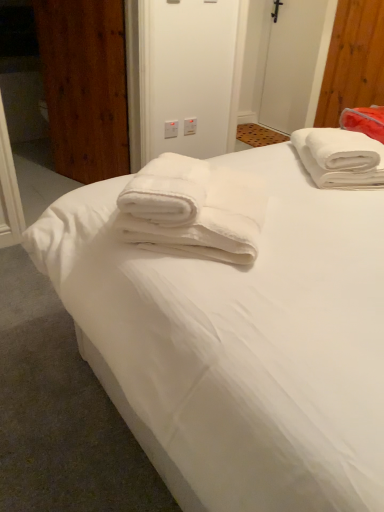
Question: Does white plastic screen door at upper center lie in front of white soft towel at upper right?

Choices:
 (A) yes
 (B) no

Answer: (B)

Question: From a real-world perspective, does white plastic screen door at upper center stand above white soft towel at upper right?

Choices:
 (A) no
 (B) yes

Answer: (A)

Question: Is white plastic screen door at upper center far away from white soft towel at upper right?

Choices:
 (A) yes
 (B) no

Answer: (A)

Question: From a real-world perspective, is white plastic screen door at upper center beneath white soft towel at upper right?

Choices:
 (A) yes
 (B) no

Answer: (A)

Question: Does white plastic screen door at upper center have a greater height compared to white soft towel at upper right?

Choices:
 (A) yes
 (B) no

Answer: (A)

Question: From a real-world perspective, is wooden door at left positioned above or below white soft towel at upper right?

Choices:
 (A) below
 (B) above

Answer: (A)

Question: Do you think wooden door at left is within white soft towel at upper right, or outside of it?

Choices:
 (A) outside
 (B) inside

Answer: (A)

Question: From the image's perspective, is wooden door at left above or below white soft towel at upper right?

Choices:
 (A) above
 (B) below

Answer: (A)

Question: Is wooden door at left wider or thinner than white soft towel at upper right?

Choices:
 (A) wide
 (B) thin

Answer: (B)

Question: Is white fluffy towel at upper right, the first towel in the back-to-front sequence, spatially inside white fluffy towel at center, which is counted as the second towel, starting from the back, or outside of it?

Choices:
 (A) inside
 (B) outside

Answer: (B)

Question: In terms of height, does white fluffy towel at upper right, arranged as the second towel when viewed from the front, look taller or shorter compared to white fluffy towel at center, the 1th towel when ordered from front to back?

Choices:
 (A) tall
 (B) short

Answer: (B)

Question: Looking at their shapes, would you say white fluffy towel at upper right, the first towel in the back-to-front sequence, is wider or thinner than white fluffy towel at center, the second towel from the right?

Choices:
 (A) thin
 (B) wide

Answer: (A)

Question: In the image, is white fluffy towel at upper right, the 2th towel viewed from the left, on the left side or the right side of white fluffy towel at center, which is counted as the second towel, starting from the back?

Choices:
 (A) left
 (B) right

Answer: (B)

Question: Relative to wooden door at left, is white fluffy towel at upper right, the first towel in the back-to-front sequence, in front or behind?

Choices:
 (A) front
 (B) behind

Answer: (A)

Question: From their relative heights in the image, would you say white fluffy towel at upper right, the 2th towel viewed from the left, is taller or shorter than wooden door at left?

Choices:
 (A) short
 (B) tall

Answer: (A)